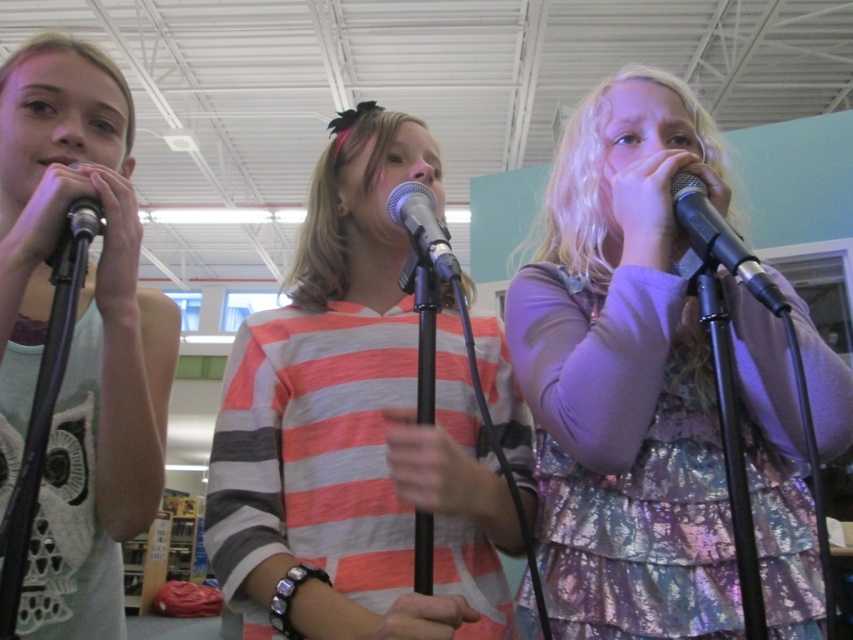
Which is below, shiny purple dress at center or striped cotton shirt at center?

Positioned lower is striped cotton shirt at center.

Is point (601, 384) positioned in front of point (393, 540)?

Yes.

Does point (577, 472) lie in front of point (369, 612)?

No, (577, 472) is behind (369, 612).

At what (x,y) coordinates should I click in order to perform the action: click on shiny purple dress at center. Please return your answer as a coordinate pair (x, y). This screenshot has height=640, width=853. Looking at the image, I should click on (625, 376).

Is striped cotton shirt at center positioned at the back of metallic silver microphone at right?

No, it is not.

Looking at this image, can you confirm if striped cotton shirt at center is positioned above metallic silver microphone at right?

Incorrect, striped cotton shirt at center is not positioned above metallic silver microphone at right.

Is point (276, 547) in front of point (675, 186)?

Yes, it is.

The width and height of the screenshot is (853, 640). Find the location of `striped cotton shirt at center`. striped cotton shirt at center is located at coordinates (354, 428).

Between striped cotton shirt at center and metallic silver microphone at center, which one appears on the left side from the viewer's perspective?

striped cotton shirt at center

Does striped cotton shirt at center appear on the left side of metallic silver microphone at center?

Correct, you'll find striped cotton shirt at center to the left of metallic silver microphone at center.

Measure the distance between point (x=405, y=134) and camera.

A distance of 1.06 meters exists between point (x=405, y=134) and camera.

Locate an element on the screen. Image resolution: width=853 pixels, height=640 pixels. striped cotton shirt at center is located at coordinates (354, 428).